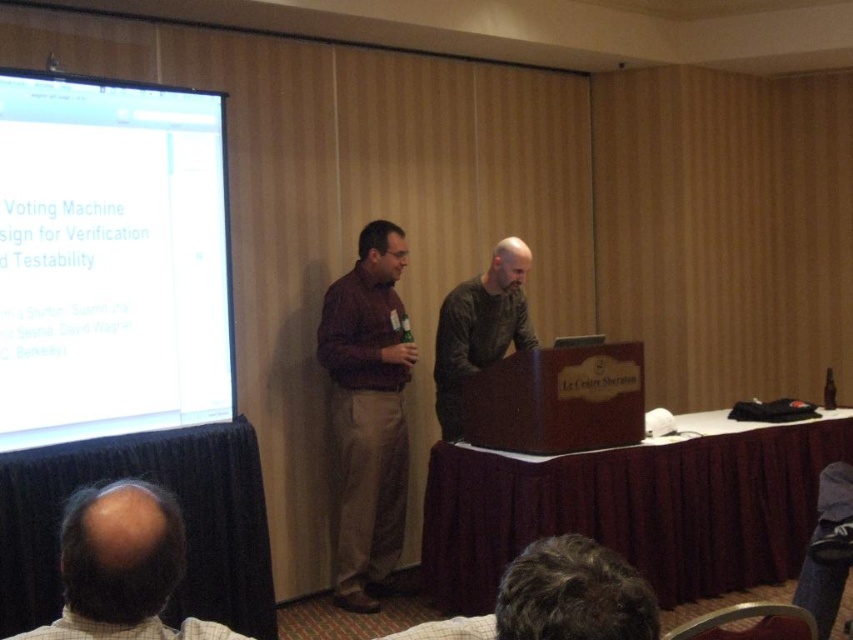
You are an event organizer setting up for a presentation. You have a white glossy projector screen at upper left and a matte brown shirt at center. Which object is shorter in height?

The white glossy projector screen at upper left is not as tall as the matte brown shirt at center, so the projector screen is shorter in height.

You are an attendee sitting in the front row of the conference. You want to see the presentation on the white glossy projector screen at upper left but notice the matte brown shirt at center is blocking your view. Can you see the screen clearly?

The white glossy projector screen at upper left is in front of the matte brown shirt at center, so you can see the screen clearly as it is not blocked by the shirt.

You are an event organizer standing at the back of the room. You need to hand out a microphone to the person wearing the matte brown shirt at center and the person with the bald head at lower left. Which person is closer to you?

The matte brown shirt at center is 9.26 feet away from bald head at lower left. Since you are at the back of the room, the bald head at lower left is closer to you than the matte brown shirt at center.